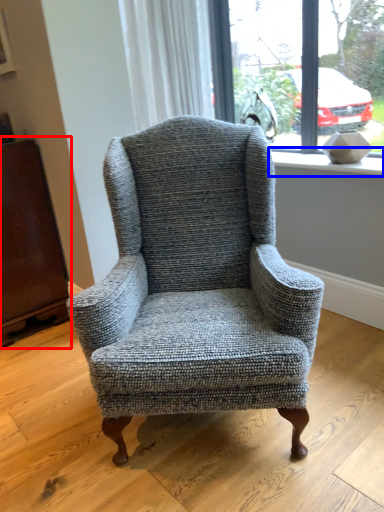
Question: Which object appears farthest to the camera in this image, armoire (highlighted by a red box) or window sill (highlighted by a blue box)?

Choices:
 (A) armoire
 (B) window sill

Answer: (A)